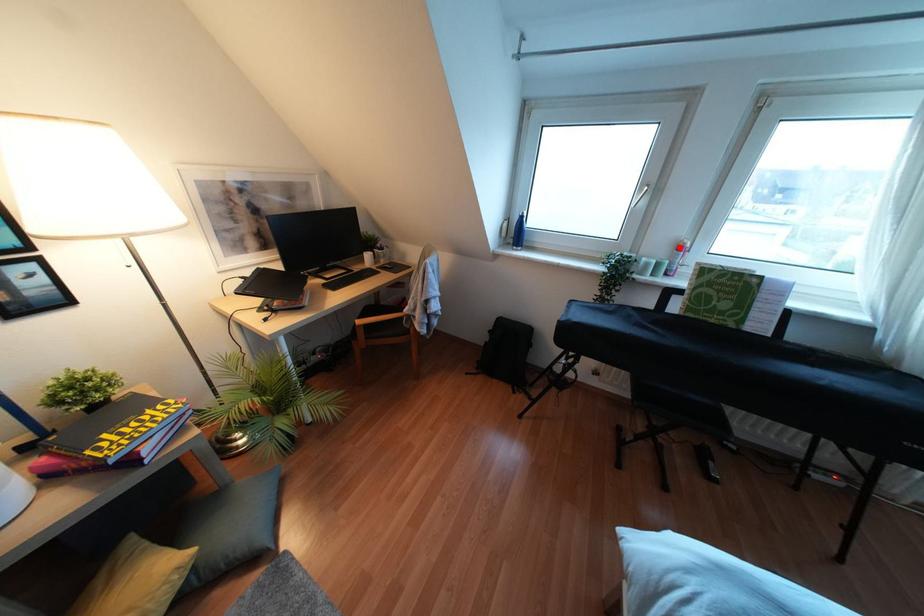
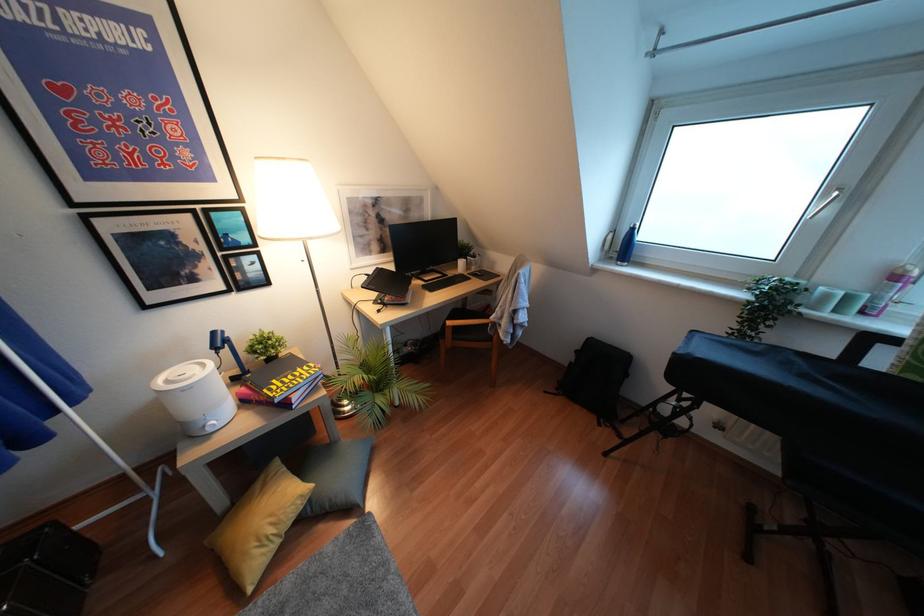
Find the pixel in the second image that matches the highlighted location in the first image.

(895, 277)